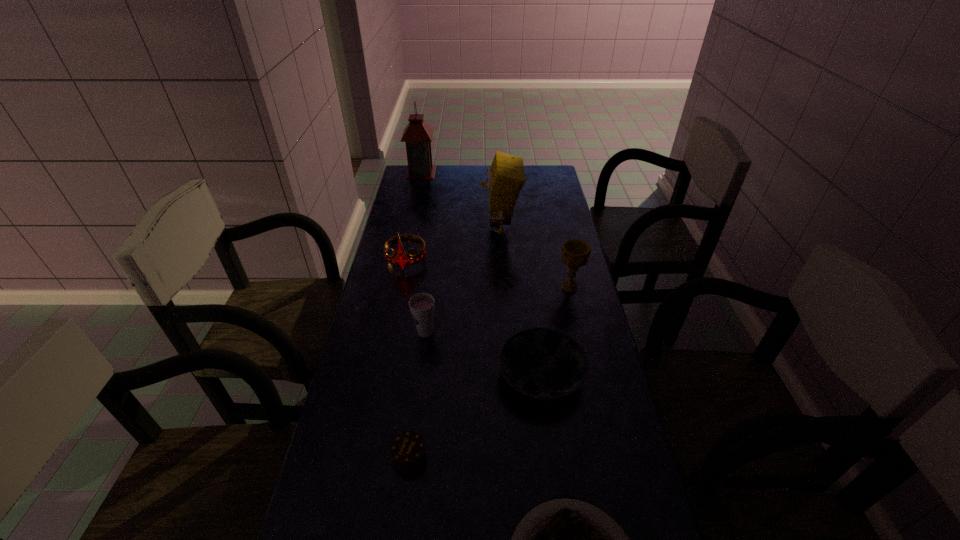
Where is `free location located 0.210m on the face of the sponge`? free location located 0.210m on the face of the sponge is located at coordinates (426, 229).

Identify the location of vacant position located 0.360m on the face of the sponge. Image resolution: width=960 pixels, height=540 pixels. (389, 229).

You are a GUI agent. You are given a task and a screenshot of the screen. Output one action in this format:
    pyautogui.click(x=<x>, y=<y>)
    Task: Click on the vacant space located 0.310m on the front-facing side of the sixth nearest object
    The image size is (960, 540).
    Given the screenshot: What is the action you would take?
    [390, 343]

This screenshot has height=540, width=960. Identify the location of free point located 0.190m on the front of the fourth farthest object. (582, 341).

The height and width of the screenshot is (540, 960). In order to click on free space located on the right of the cup in this screenshot , I will do `click(553, 333)`.

Where is `free location located on the front of the taller plate`? free location located on the front of the taller plate is located at coordinates (560, 516).

Locate an element on the screen. vacant space located on the right of the chocolate cake is located at coordinates (515, 456).

Locate an element on the screen. The width and height of the screenshot is (960, 540). object positioned at the far edge is located at coordinates (418, 134).

Where is `lantern that is positioned at the left edge`? lantern that is positioned at the left edge is located at coordinates (418, 134).

The width and height of the screenshot is (960, 540). I want to click on tiara present at the left edge, so click(x=401, y=259).